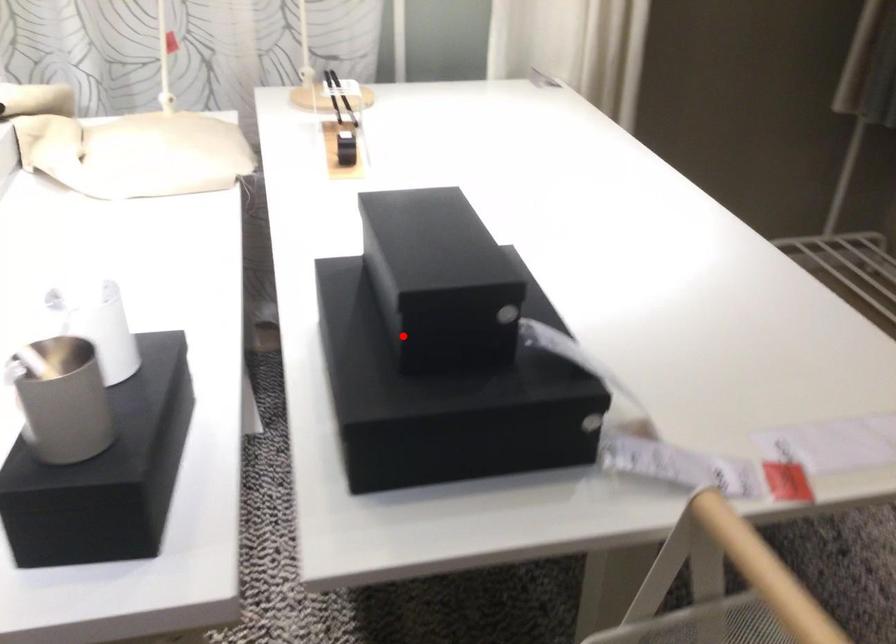
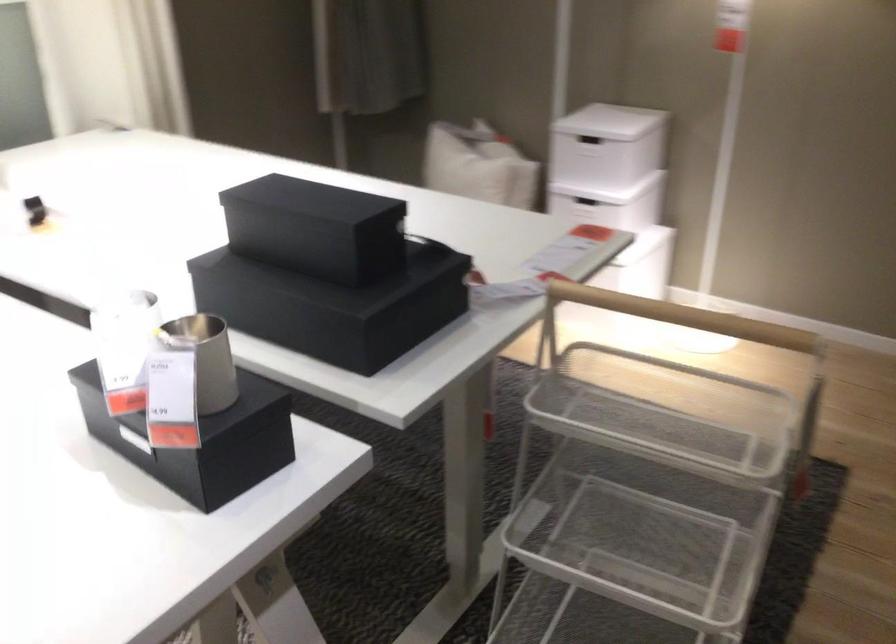
Question: A red point is marked in image1. In image2, is the corresponding 3D point closer to the camera or farther? Reply with the corresponding letter.

Choices:
 (A) The corresponding 3D point is closer.
 (B) The corresponding 3D point is farther.

Answer: (B)